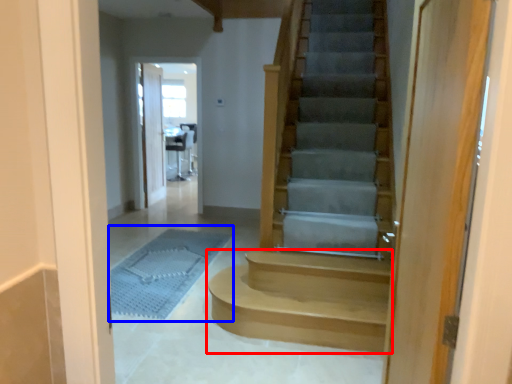
Question: Which of the following is the closest to the observer, stairs (highlighted by a red box) or bath mat (highlighted by a blue box)?

Choices:
 (A) stairs
 (B) bath mat

Answer: (A)